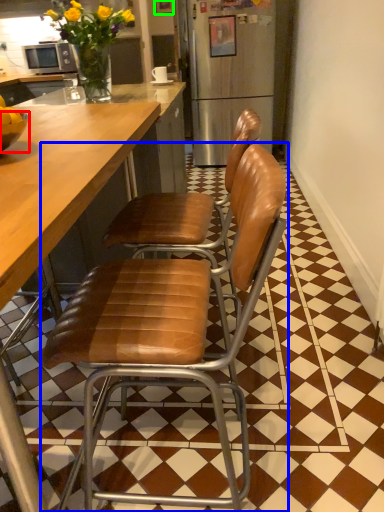
Question: Which object is the farthest from bowl (highlighted by a red box)? Choose among these: chair (highlighted by a blue box) or picture frame (highlighted by a green box).

Choices:
 (A) chair
 (B) picture frame

Answer: (B)